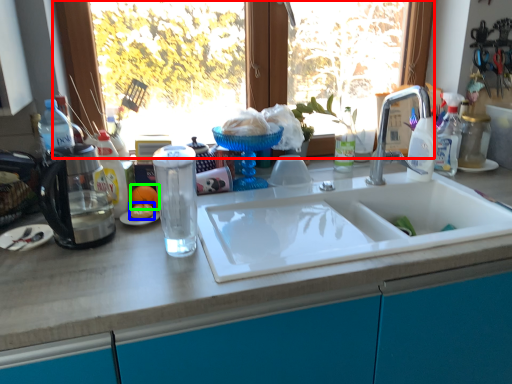
Question: Which object is the closest to the window (highlighted by a red box)? Choose among these: food (highlighted by a blue box) or orange (highlighted by a green box).

Choices:
 (A) food
 (B) orange

Answer: (B)